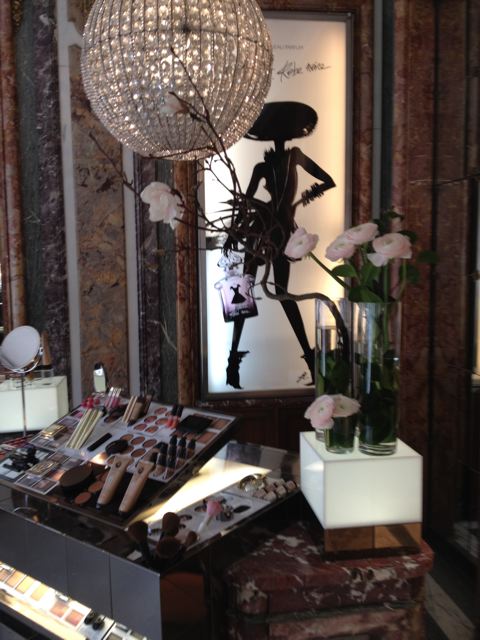
Locate an element on the screen. chandelier is located at coordinates (210, 36).